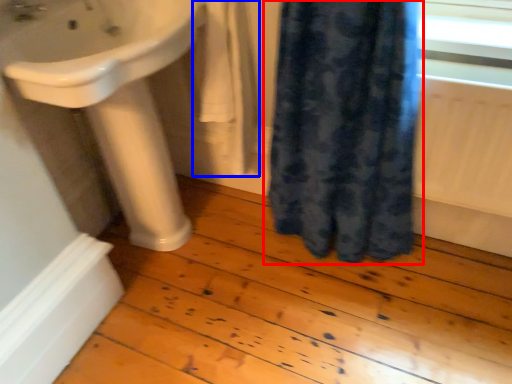
Question: Among these objects, which one is nearest to the camera, curtain (highlighted by a red box) or bath towel (highlighted by a blue box)?

Choices:
 (A) curtain
 (B) bath towel

Answer: (A)